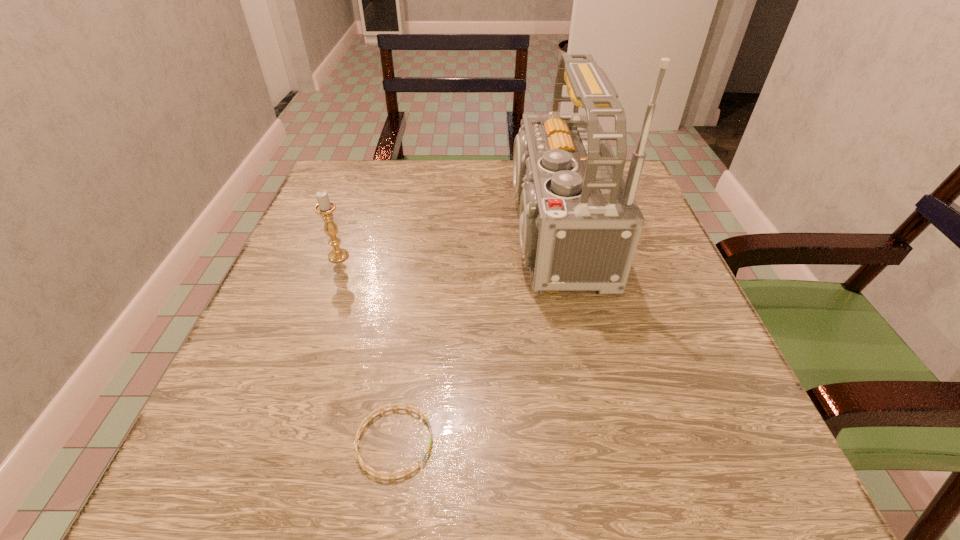
This screenshot has width=960, height=540. In the image, there is a desktop. What are the coordinates of `vacant space at the near left corner` in the screenshot? It's located at (272, 462).

In the image, there is a desktop. Identify the location of free space at the far right corner. click(x=645, y=198).

Locate an element on the screen. The image size is (960, 540). free space between the nearest object and the candle holder is located at coordinates (367, 349).

Where is `vacant area that lies between the leftmost object and the radio receiver`? This screenshot has width=960, height=540. vacant area that lies between the leftmost object and the radio receiver is located at coordinates (441, 244).

Image resolution: width=960 pixels, height=540 pixels. Find the location of `free space that is in between the shortest object and the second shortest object`. free space that is in between the shortest object and the second shortest object is located at coordinates (367, 349).

You are a GUI agent. You are given a task and a screenshot of the screen. Output one action in this format:
    pyautogui.click(x=<x>, y=<y>)
    Task: Click on the vacant area that lies between the second tallest object and the nearest object
    
    Given the screenshot: What is the action you would take?
    pyautogui.click(x=367, y=349)

Where is `vacant area between the radio receiver and the leftmost object`? The height and width of the screenshot is (540, 960). vacant area between the radio receiver and the leftmost object is located at coordinates (441, 244).

Where is `empty space between the leftmost object and the tallest object`? This screenshot has height=540, width=960. empty space between the leftmost object and the tallest object is located at coordinates (441, 244).

The height and width of the screenshot is (540, 960). I want to click on unoccupied position between the tallest object and the second tallest object, so click(x=441, y=244).

This screenshot has width=960, height=540. I want to click on blank region between the leftmost object and the rightmost object, so click(x=441, y=244).